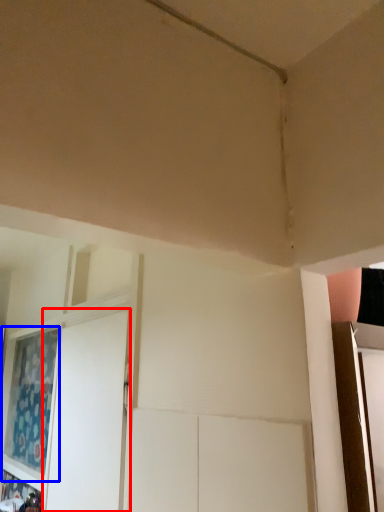
Question: Which of the following is the closest to the observer, screen door (highlighted by a red box) or curtain (highlighted by a blue box)?

Choices:
 (A) screen door
 (B) curtain

Answer: (A)